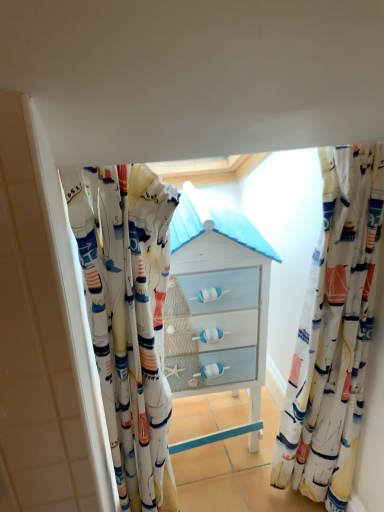
Identify the location of vacant space underneath matte white chest of drawers at center (from a real-world perspective). The image size is (384, 512). (205, 434).